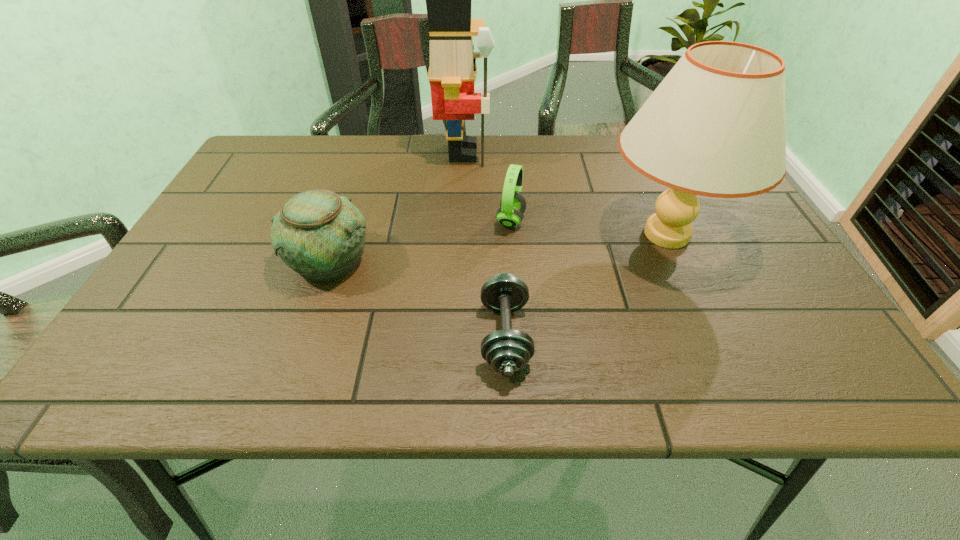
Find the location of `free space that satisfies the following two spatial constraints: 1. on the back side of the shortest object; 2. on the left side of the headset`. free space that satisfies the following two spatial constraints: 1. on the back side of the shortest object; 2. on the left side of the headset is located at coordinates (499, 220).

What are the coordinates of `free region that satisfies the following two spatial constraints: 1. on the back side of the headset; 2. on the left side of the pottery` in the screenshot? It's located at pyautogui.click(x=342, y=220).

Where is `vacant space that satisfies the following two spatial constraints: 1. in front of the lampshade holding the staff; 2. on the right side of the farthest object`? vacant space that satisfies the following two spatial constraints: 1. in front of the lampshade holding the staff; 2. on the right side of the farthest object is located at coordinates (459, 234).

Where is `blank space that satisfies the following two spatial constraints: 1. in front of the farthest object holding the staff; 2. on the right side of the dumbbell`? Image resolution: width=960 pixels, height=540 pixels. blank space that satisfies the following two spatial constraints: 1. in front of the farthest object holding the staff; 2. on the right side of the dumbbell is located at coordinates click(x=454, y=336).

Identify the location of free point that satisfies the following two spatial constraints: 1. in front of the lampshade holding the staff; 2. on the left side of the farthest object. The image size is (960, 540). (459, 234).